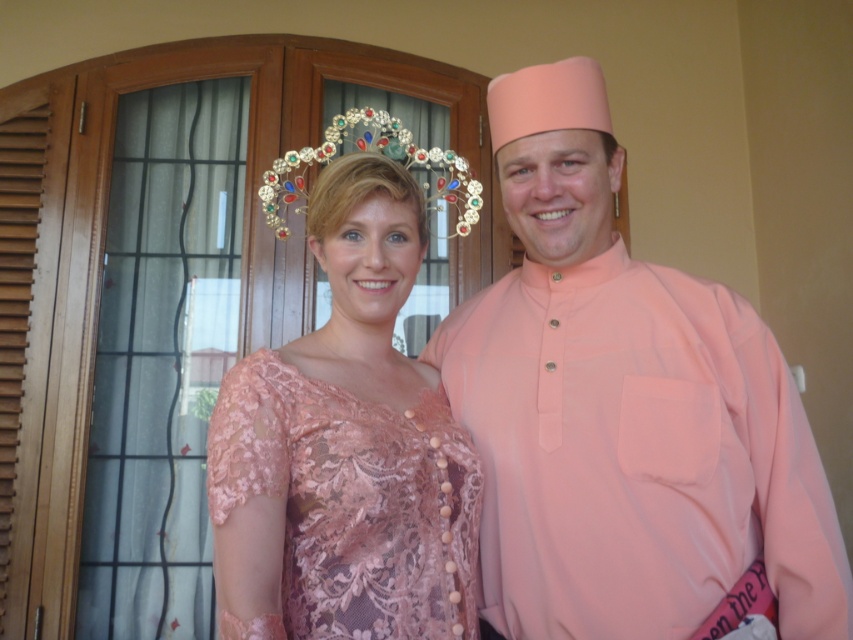
You are a photographer setting up for a formal event. You need to ensure that both the matte peach shirt at center and the lace fabric dress at center are visible in the photo. Based on their positions, which one might partially block the other?

The lace fabric dress at center is behind the matte peach shirt at center, so the matte peach shirt at center might partially block the lace fabric dress at center.

You are planning to take a photo of the lace fabric dress at center and the multicolored jeweled tiara at upper center. Which object should you focus on first if you want to capture both in a single frame without moving the camera?

The multicolored jeweled tiara at upper center should be focused on first because the lace fabric dress at center is to the right of it, so adjusting focus to the tiara ensures both objects are within the frame.

You are standing in the room and want to determine which of the two points, point (778, 432) or point (306, 156), is closer to you. Based on the scene, which point is nearer?

Point (778, 432) is closer to the viewer than point (306, 156).